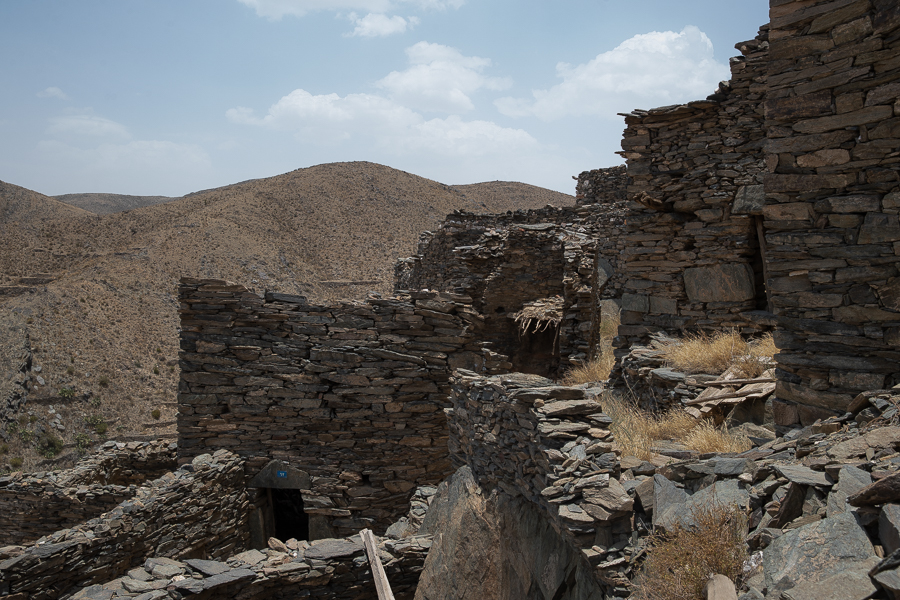
The image size is (900, 600). I want to click on green plant, so click(42, 439), click(15, 458), click(100, 428), click(86, 424), click(96, 403), click(79, 456).